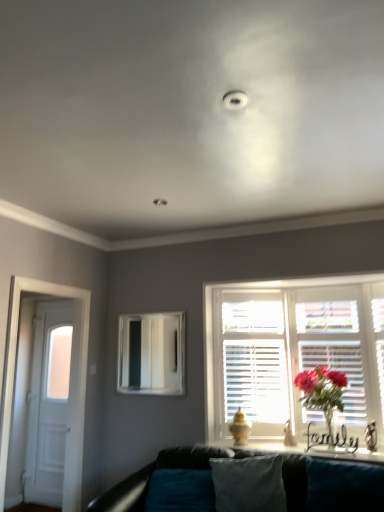
Question: Considering the relative positions of velvety teal pillow at center and matte pink flowers at window in the image provided, is velvety teal pillow at center to the left of matte pink flowers at window from the viewer's perspective?

Choices:
 (A) yes
 (B) no

Answer: (A)

Question: From a real-world perspective, is velvety teal pillow at center under matte pink flowers at window?

Choices:
 (A) no
 (B) yes

Answer: (B)

Question: Is velvety teal pillow at center smaller than matte pink flowers at window?

Choices:
 (A) yes
 (B) no

Answer: (B)

Question: Is matte pink flowers at window completely or partially inside velvety teal pillow at center?

Choices:
 (A) no
 (B) yes

Answer: (A)

Question: Considering the relative positions of velvety teal pillow at center and matte pink flowers at window in the image provided, is velvety teal pillow at center in front of matte pink flowers at window?

Choices:
 (A) yes
 (B) no

Answer: (A)

Question: Could you tell me if velvety teal pillow at center is turned towards matte pink flowers at window?

Choices:
 (A) no
 (B) yes

Answer: (A)

Question: Is matte pink flowers at window positioned far away from metallic silver mirror at center?

Choices:
 (A) no
 (B) yes

Answer: (B)

Question: From the image's perspective, would you say matte pink flowers at window is shown under metallic silver mirror at center?

Choices:
 (A) no
 (B) yes

Answer: (B)

Question: Can you confirm if matte pink flowers at window is thinner than metallic silver mirror at center?

Choices:
 (A) no
 (B) yes

Answer: (A)

Question: Could metallic silver mirror at center be considered to be inside matte pink flowers at window?

Choices:
 (A) yes
 (B) no

Answer: (B)

Question: Does matte pink flowers at window have a greater width compared to metallic silver mirror at center?

Choices:
 (A) yes
 (B) no

Answer: (A)

Question: Is matte pink flowers at window to the left of metallic silver mirror at center from the viewer's perspective?

Choices:
 (A) yes
 (B) no

Answer: (B)

Question: Is white wooden shutters at center located within white wooden door at left?

Choices:
 (A) no
 (B) yes

Answer: (A)